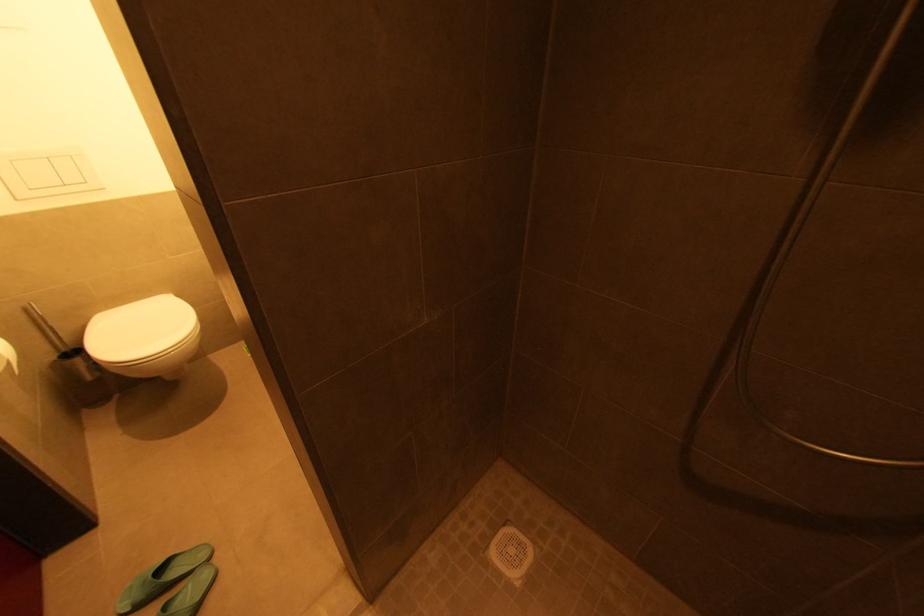
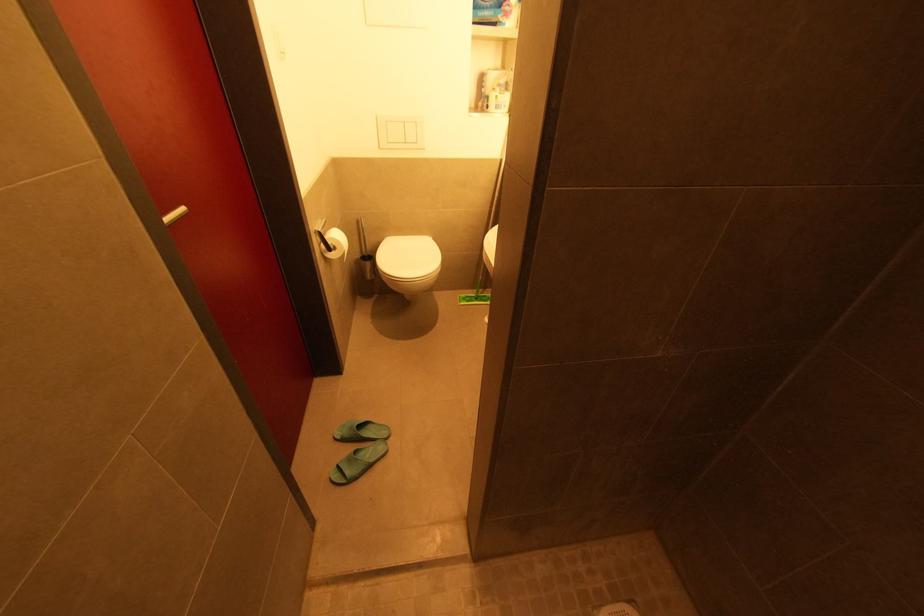
Question: The images are taken continuously from a first-person perspective. In which direction is your viewpoint rotating?

Choices:
 (A) Left
 (B) Right
 (C) Up
 (D) Down

Answer: (A)